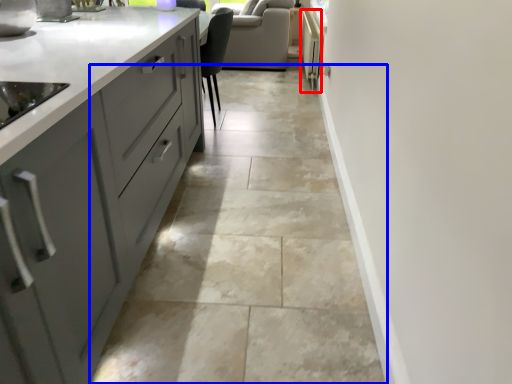
Question: Which object is closer to the camera taking this photo, appliance (highlighted by a red box) or granite (highlighted by a blue box)?

Choices:
 (A) appliance
 (B) granite

Answer: (B)